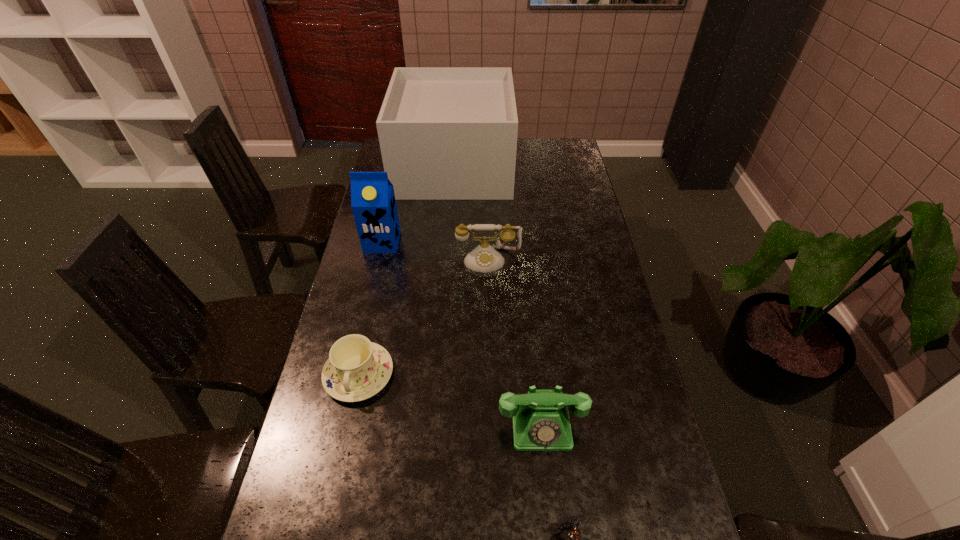
Find the location of a particular element. The height and width of the screenshot is (540, 960). object situated at the far edge is located at coordinates [x=446, y=133].

The image size is (960, 540). Find the location of `box situated at the left edge`. box situated at the left edge is located at coordinates (446, 133).

The height and width of the screenshot is (540, 960). In order to click on carton situated at the left edge in this screenshot , I will do `click(373, 203)`.

This screenshot has height=540, width=960. Identify the location of chinaware that is at the left edge. (357, 369).

Locate an element on the screen. The image size is (960, 540). object present at the far left corner is located at coordinates (446, 133).

This screenshot has height=540, width=960. In the image, there is a desktop. In order to click on free space at the far edge in this screenshot , I will do `click(541, 160)`.

At what (x,y) coordinates should I click in order to perform the action: click on blank space at the left edge of the desktop. Please return your answer as a coordinate pair (x, y). Image resolution: width=960 pixels, height=540 pixels. Looking at the image, I should click on (378, 263).

The image size is (960, 540). In the image, there is a desktop. In order to click on blank space at the right edge in this screenshot , I will do `click(576, 187)`.

Identify the location of vacant space at the far right corner of the desktop. This screenshot has height=540, width=960. (549, 140).

Locate an element on the screen. Image resolution: width=960 pixels, height=540 pixels. free area in between the farthest telephone and the box is located at coordinates (471, 213).